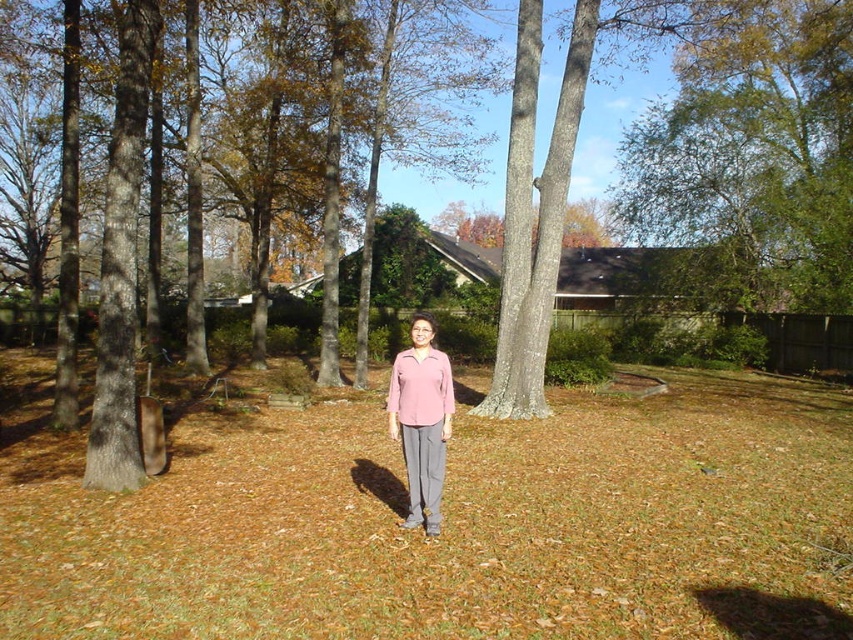
Is point (412, 324) more distant than point (431, 390)?

Yes, it is.

Is pink matte shirt at center behind pink matte sweater at center?

No, pink matte shirt at center is in front of pink matte sweater at center.

Where is `pink matte shirt at center`? pink matte shirt at center is located at coordinates (421, 420).

Can you confirm if brown grass at center is bigger than pink matte sweater at center?

Yes, brown grass at center is bigger than pink matte sweater at center.

Looking at this image, can you confirm if brown grass at center is wider than pink matte sweater at center?

Indeed, brown grass at center has a greater width compared to pink matte sweater at center.

This screenshot has height=640, width=853. What do you see at coordinates (453, 524) in the screenshot?
I see `brown grass at center` at bounding box center [453, 524].

In order to click on brown grass at center in this screenshot , I will do `click(453, 524)`.

The image size is (853, 640). Identify the location of brown grass at center. (453, 524).

The width and height of the screenshot is (853, 640). Identify the location of brown grass at center. (453, 524).